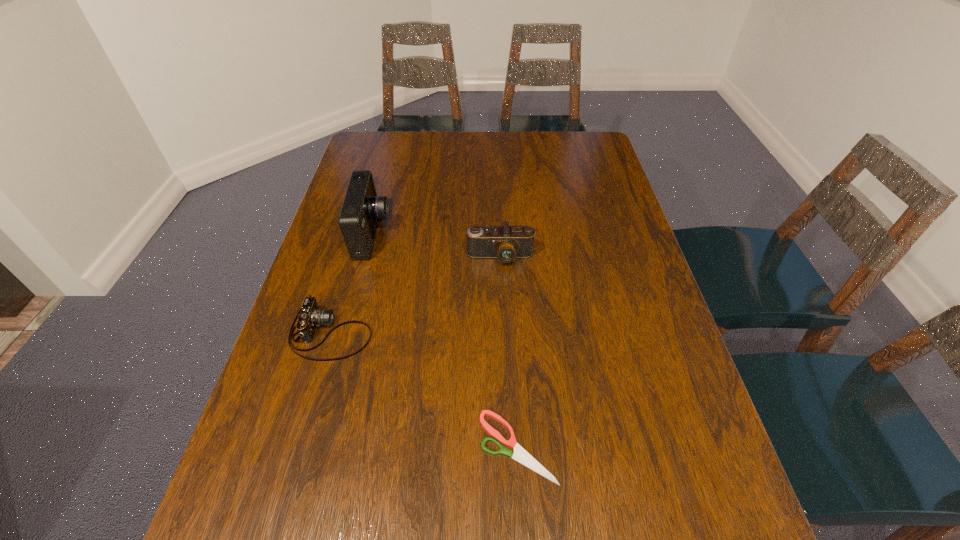
This screenshot has height=540, width=960. I want to click on free space located 0.280m on the back of the scissors, so click(x=509, y=306).

Locate an element on the screen. free region at the far edge of the desktop is located at coordinates (486, 135).

This screenshot has width=960, height=540. What are the coordinates of `vacant space at the left edge of the desktop` in the screenshot? It's located at (379, 186).

Where is `vacant space at the right edge of the desktop`? The image size is (960, 540). vacant space at the right edge of the desktop is located at coordinates (615, 379).

In the image, there is a desktop. At what (x,y) coordinates should I click in order to perform the action: click on free space at the far right corner. Please return your answer as a coordinate pair (x, y). Looking at the image, I should click on (564, 147).

You are a GUI agent. You are given a task and a screenshot of the screen. Output one action in this format:
    pyautogui.click(x=<x>, y=<y>)
    Task: Click on the free space between the nearest object and the shortest camera
    The image size is (960, 540).
    Given the screenshot: What is the action you would take?
    pyautogui.click(x=424, y=390)

The height and width of the screenshot is (540, 960). What are the coordinates of `vacant point located between the nearest object and the nearest camera` in the screenshot? It's located at (424, 390).

I want to click on unoccupied area between the rightmost camera and the nearest object, so click(x=509, y=352).

This screenshot has width=960, height=540. What are the coordinates of `vacant point located between the tallest camera and the nearest camera` in the screenshot? It's located at (351, 284).

Find the location of a particular element. The image size is (960, 540). vacant area between the tallest camera and the nearest object is located at coordinates (444, 341).